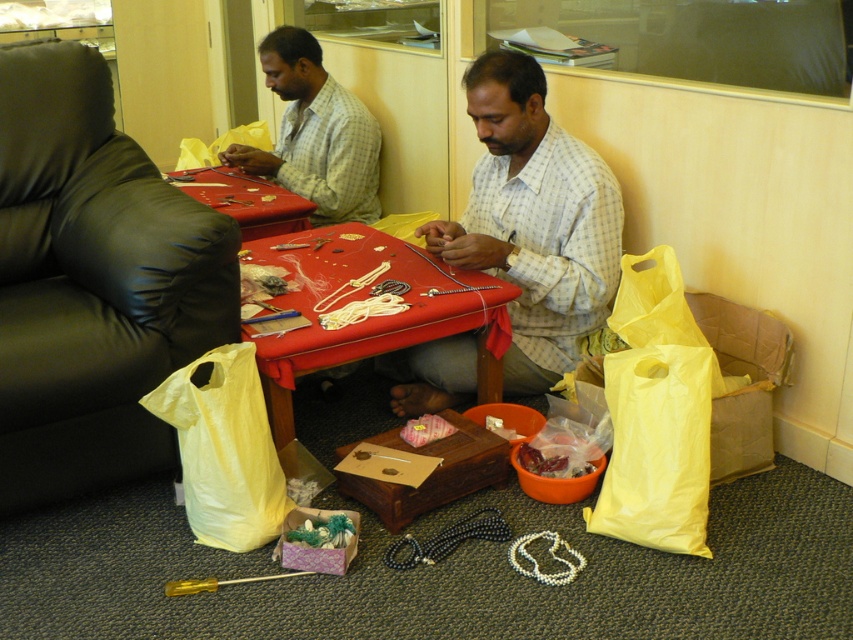
Where is the yellow plastic bag at lower right located in the image?

The yellow plastic bag at lower right is located at point (657,412) in the image.

You are standing in the room and see the two points labeled as point (99, 200) and point (573, 476). Which point is closer to the wall that the individuals are leaning against?

Point (99, 200) is behind point (573, 476), so it is closer to the wall that the individuals are leaning against.

From the picture: You are standing in the room and want to place a new item on the table that is closer to you. Which table should you choose between the point at (701, 522) and the point at (247, 221)?

You should choose the table at point (701, 522) because it is closer to you than the table at point (247, 221) according to the coordinates provided.